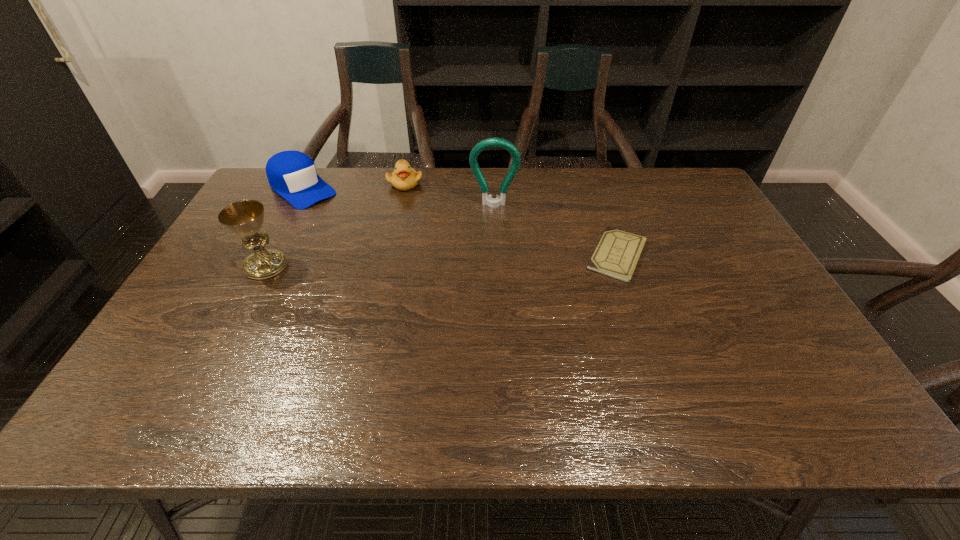
This screenshot has height=540, width=960. I want to click on vacant space on the desktop that is between the chalice and the checkbook and is positioned on the front-facing side of the second shortest object, so pyautogui.click(x=428, y=261).

This screenshot has height=540, width=960. What are the coordinates of `free spot on the desktop that is between the chalice and the checkbook and is positioned on the front-facing side of the third tallest object` in the screenshot? It's located at (392, 262).

Locate an element on the screen. The width and height of the screenshot is (960, 540). free spot on the desktop that is between the fourth shortest object and the rightmost object and is positioned at the jaws of the tallest object is located at coordinates (493, 259).